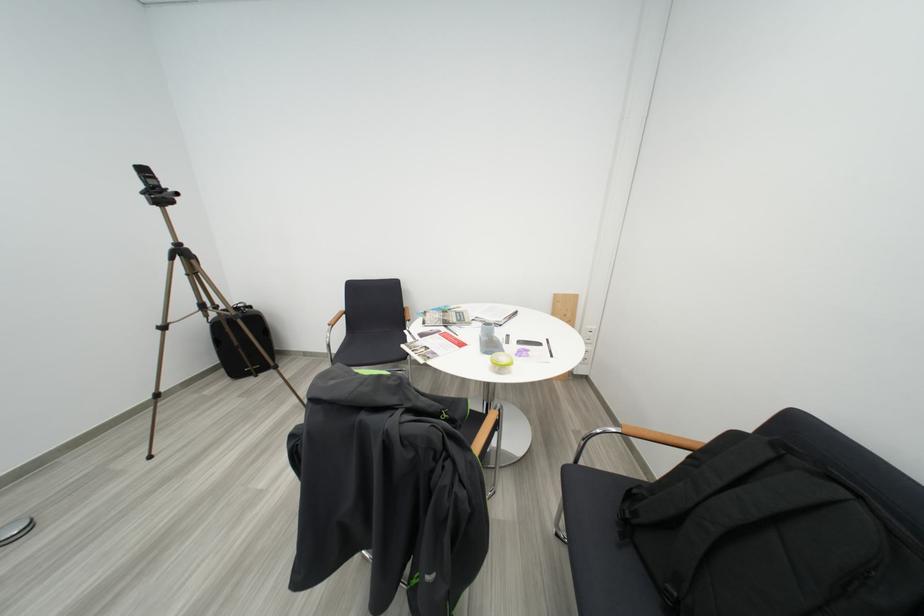
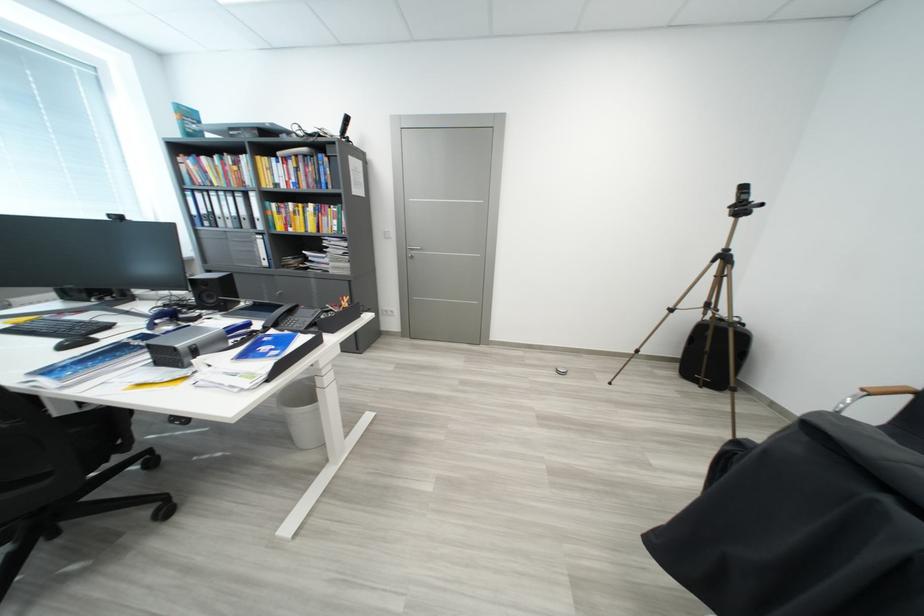
The point at (236, 384) is marked in the first image. Where is the corresponding point in the second image?

(684, 377)